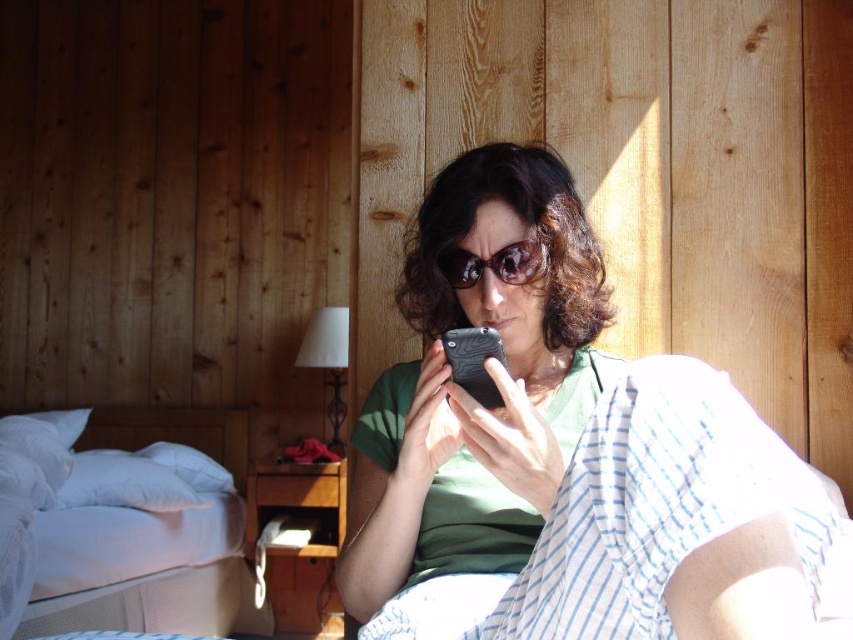
In the scene shown: Is matte black phone at center smaller than shiny brown sunglasses at center?

Incorrect, matte black phone at center is not smaller in size than shiny brown sunglasses at center.

Can you confirm if matte black phone at center is positioned to the right of shiny brown sunglasses at center?

Yes, matte black phone at center is to the right of shiny brown sunglasses at center.

Does point (566, 403) come farther from viewer compared to point (535, 248)?

Yes, it is behind point (535, 248).

This screenshot has height=640, width=853. I want to click on matte black phone at center, so click(474, 401).

Is shiny brown sunglasses at center in front of black matte smartphone at center?

No, shiny brown sunglasses at center is further to the viewer.

Is point (500, 276) closer to camera compared to point (459, 372)?

No, it is not.

Does point (497, 262) lie in front of point (476, 378)?

No, (497, 262) is further to viewer.

Locate an element on the screen. shiny brown sunglasses at center is located at coordinates (494, 264).

From the picture: Who is more distant from viewer, [26,600] or [532,275]?

Point [26,600]

Can you confirm if white soft bed at lower left is wider than shiny brown sunglasses at center?

Correct, the width of white soft bed at lower left exceeds that of shiny brown sunglasses at center.

Which is in front, point (35, 545) or point (517, 257)?

Point (517, 257) is more forward.

Image resolution: width=853 pixels, height=640 pixels. Identify the location of white soft bed at lower left. (119, 545).